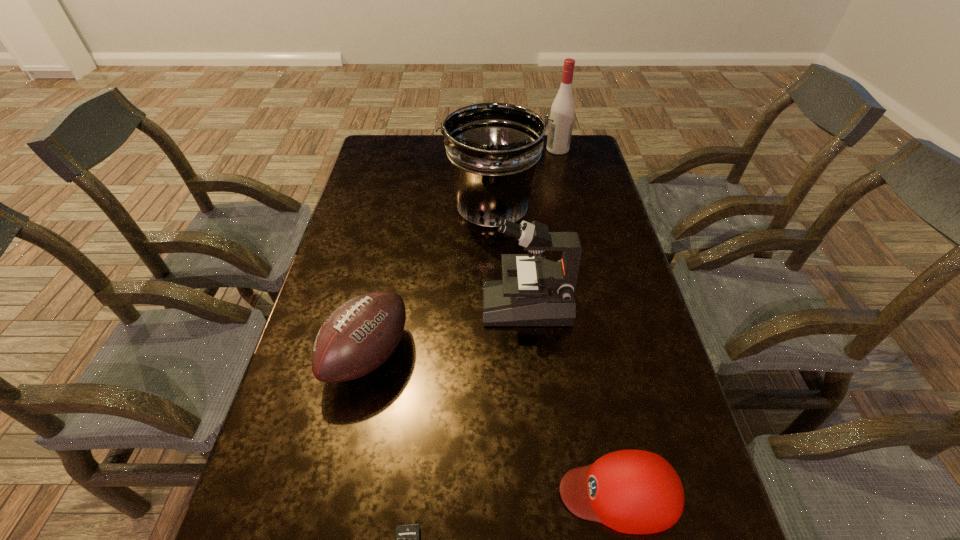
Locate which object ranks third in proximity to the microscope. Please provide its 2D coordinates. Your answer should be formatted as a tuple, i.e. [(x, y)], where the tuple contains the x and y coordinates of a point satisfying the conditions above.

[(630, 491)]

Identify which object is the second closest to the fifth tallest object. Please provide its 2D coordinates. Your answer should be formatted as a tuple, i.e. [(x, y)], where the tuple contains the x and y coordinates of a point satisfying the conditions above.

[(543, 293)]

You are a GUI agent. You are given a task and a screenshot of the screen. Output one action in this format:
    pyautogui.click(x=<x>, y=<y>)
    Task: Click on the vacant area in the image that satisfies the following two spatial constraints: 1. on the back side of the second farthest object; 2. on the right side of the third shortest object
    The width and height of the screenshot is (960, 540).
    Given the screenshot: What is the action you would take?
    pyautogui.click(x=398, y=212)

I want to click on blank space that satisfies the following two spatial constraints: 1. on the label of the alcohol; 2. on the front side of the bucket, so point(572,212).